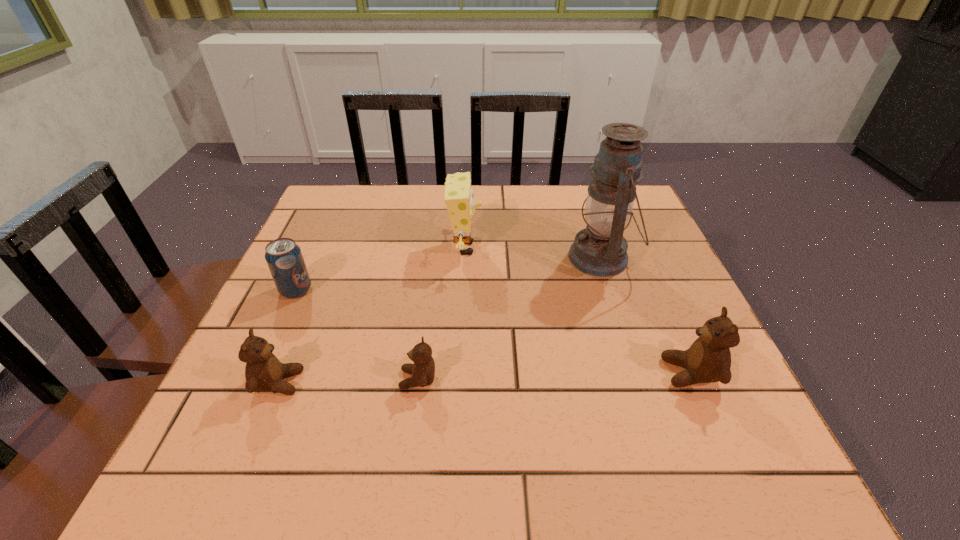
Find the location of a particular element. This screenshot has width=960, height=540. the leftmost teddy bear is located at coordinates (264, 372).

In order to click on the third object from left to right in this screenshot , I will do `click(423, 370)`.

You are a GUI agent. You are given a task and a screenshot of the screen. Output one action in this format:
    pyautogui.click(x=<x>, y=<y>)
    Task: Click on the second teddy bear from right to left
    The width and height of the screenshot is (960, 540).
    Given the screenshot: What is the action you would take?
    pyautogui.click(x=423, y=370)

Where is `the fourth shortest object`? The image size is (960, 540). the fourth shortest object is located at coordinates (708, 359).

I want to click on the tallest teddy bear, so click(708, 359).

What are the coordinates of `the tallest object` in the screenshot? It's located at (601, 250).

You are a GUI agent. You are given a task and a screenshot of the screen. Output one action in this format:
    pyautogui.click(x=<x>, y=<y>)
    Task: Click on the sponge
    
    Given the screenshot: What is the action you would take?
    pyautogui.click(x=458, y=196)

This screenshot has width=960, height=540. In order to click on the second tallest object in this screenshot , I will do `click(458, 196)`.

This screenshot has height=540, width=960. What are the coordinates of `pop soda` in the screenshot? It's located at (284, 258).

Locate an element on the screen. This screenshot has height=540, width=960. vacant region located at the face of the second tallest teddy bear is located at coordinates (470, 383).